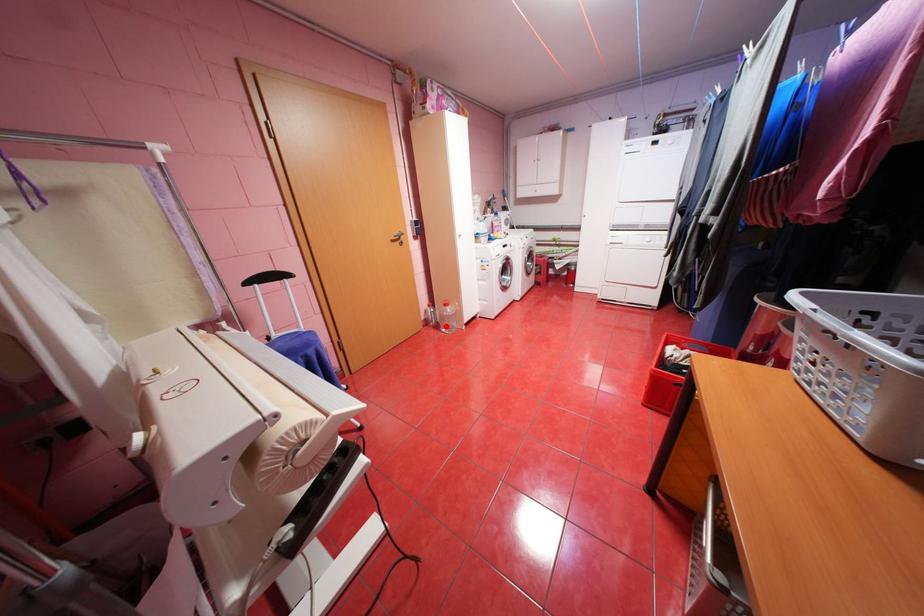
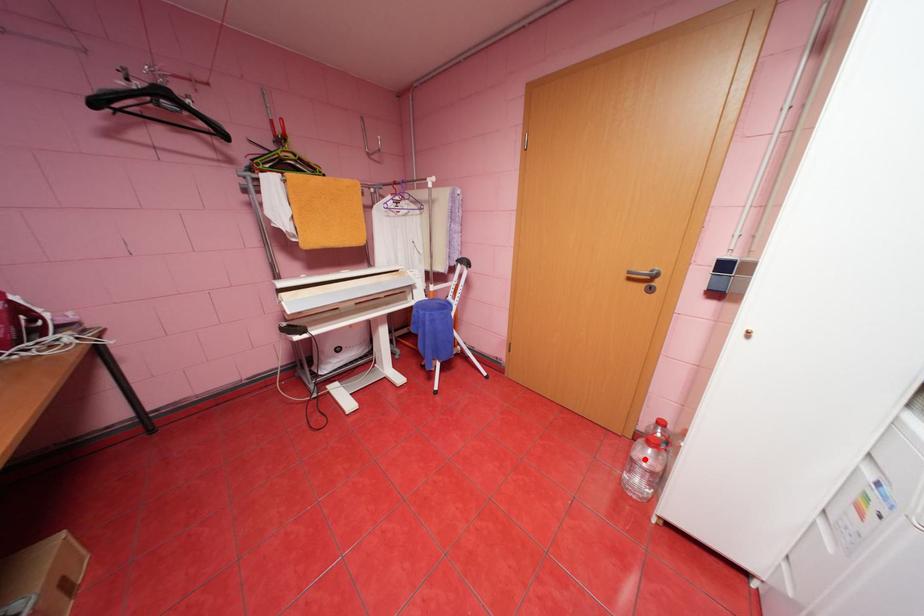
I am providing you with two images of the same scene from different viewpoints. A red point is marked on the first image and another point is marked on the second image. Is the red point in image1 aligned with the point shown in image2?

Yes